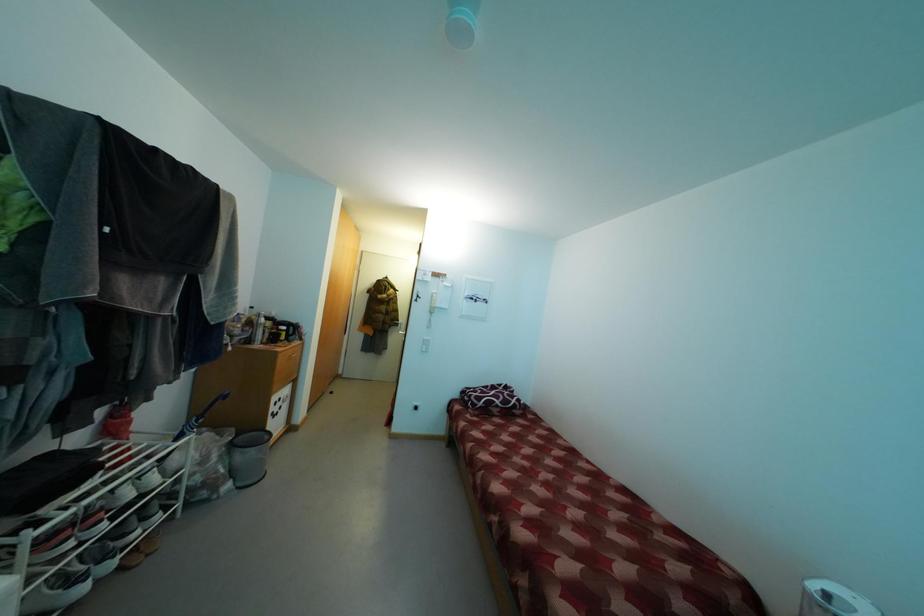
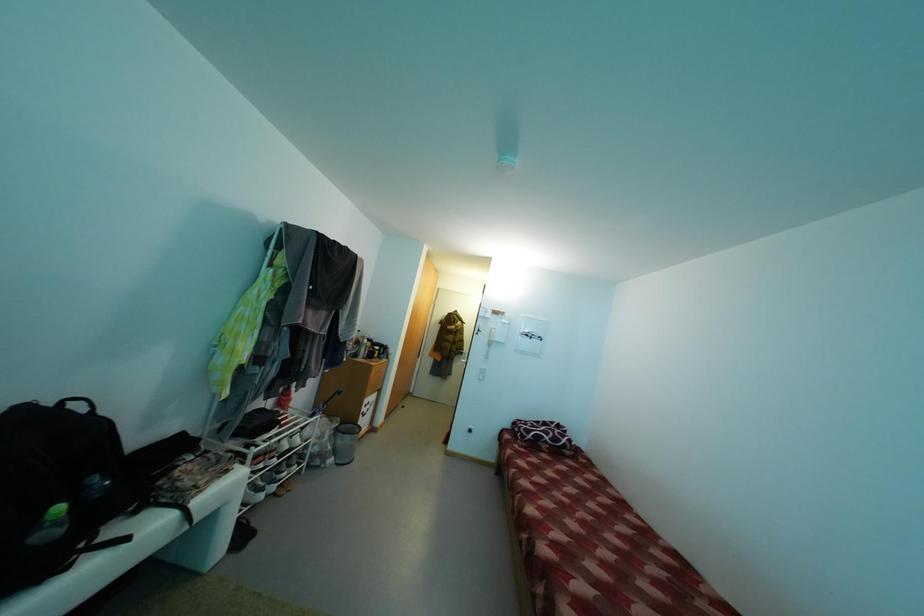
Question: The camera is either moving clockwise (left) or counter-clockwise (right) around the object. The first image is from the beginning of the video and the second image is from the end. Is the camera moving left or right when shooting the video?

Choices:
 (A) Left
 (B) Right

Answer: (B)